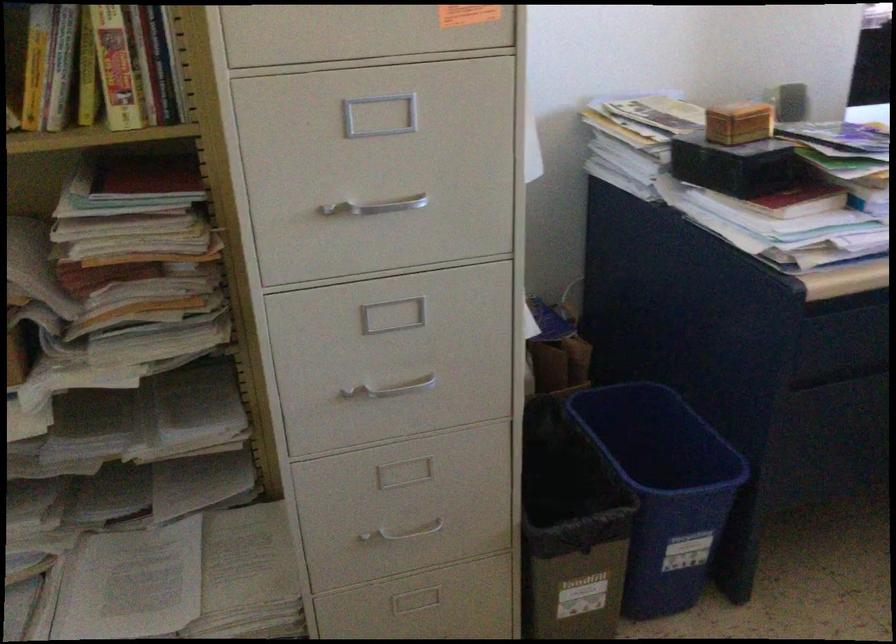
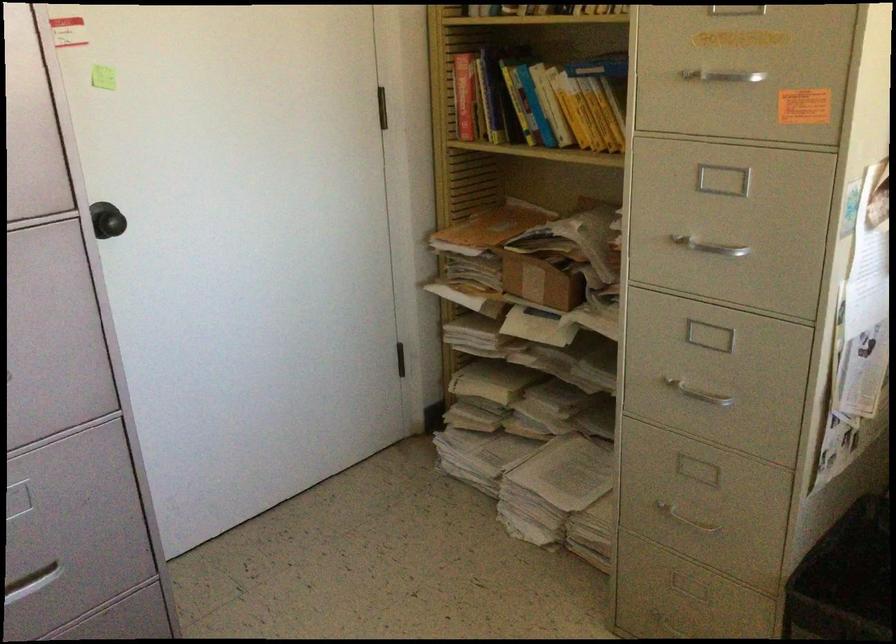
Question: I am providing you with two images of the same scene from different viewpoints. After the viewpoint changes to image2, which objects are now occluded?

Choices:
 (A) black doorknob
 (B) yellow book
 (C) small cardboard box
 (D) none of these

Answer: (D)